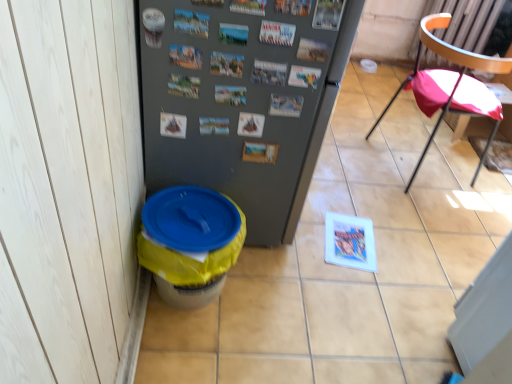
Question: Is gray matte refrigerator at center in front of or behind yellow plastic potty at lower left in the image?

Choices:
 (A) front
 (B) behind

Answer: (A)

Question: Is gray matte refrigerator at center wider or thinner than yellow plastic potty at lower left?

Choices:
 (A) wide
 (B) thin

Answer: (A)

Question: Estimate the real-world distances between objects in this image. Which object is closer to the gray matte refrigerator at center?

Choices:
 (A) pink fabric chair at right
 (B) yellow plastic trash can at lower left
 (C) yellow plastic potty at lower left

Answer: (C)

Question: Which object is the farthest from the yellow plastic trash can at lower left?

Choices:
 (A) pink fabric chair at right
 (B) gray matte refrigerator at center
 (C) yellow plastic potty at lower left

Answer: (B)